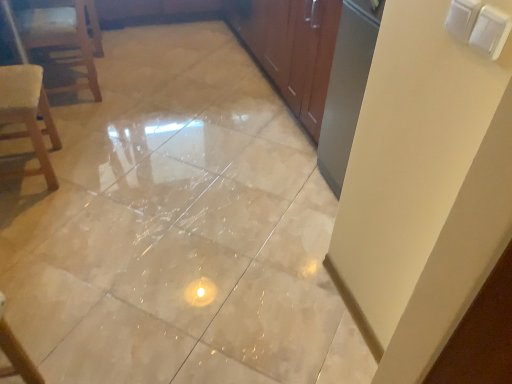
Locate an element on the screen. The image size is (512, 384). vacant space to the right of wooden textured chair at left is located at coordinates (99, 173).